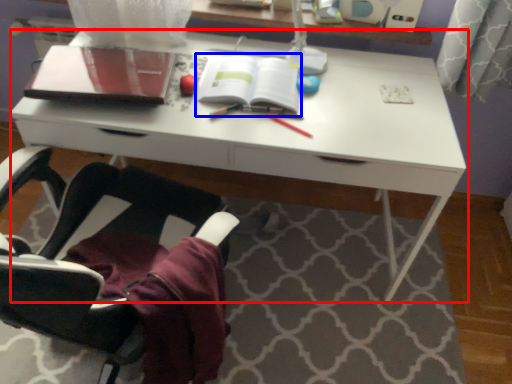
Question: Among these objects, which one is farthest to the camera, desk (highlighted by a red box) or paperback book (highlighted by a blue box)?

Choices:
 (A) desk
 (B) paperback book

Answer: (B)